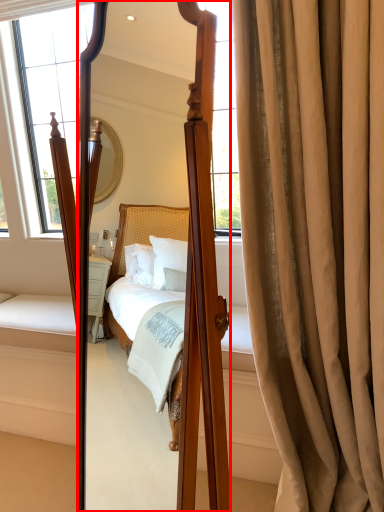
Question: From the image's perspective, what is the correct spatial positioning of mirror (annotated by the red box) in reference to curtain?

Choices:
 (A) below
 (B) above

Answer: (A)